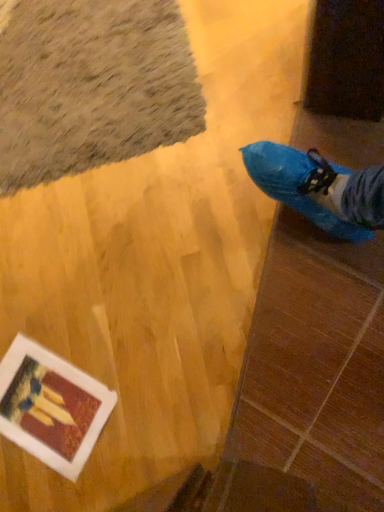
Where is `free spot to the right of white matte painting at lower left`? free spot to the right of white matte painting at lower left is located at coordinates (123, 331).